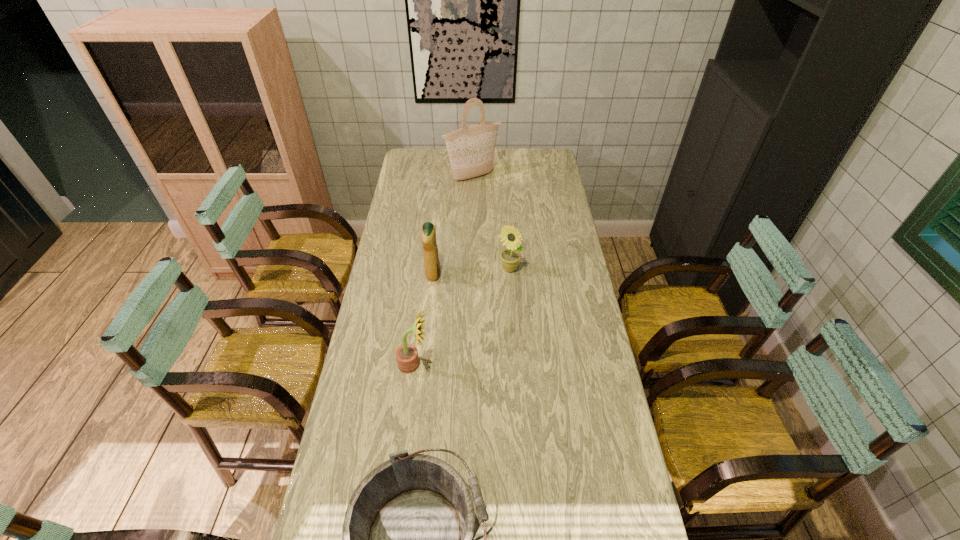
This screenshot has height=540, width=960. What are the coordinates of `object that is the second closest to the farther sunflower` in the screenshot? It's located at [407, 358].

You are a GUI agent. You are given a task and a screenshot of the screen. Output one action in this format:
    pyautogui.click(x=<x>, y=<y>)
    Task: Click on the vacant region that satisfies the following two spatial constraints: 1. on the face of the right sunflower; 2. on the face of the second nearest object
    Image resolution: width=960 pixels, height=540 pixels.
    Given the screenshot: What is the action you would take?
    pyautogui.click(x=516, y=364)

Image resolution: width=960 pixels, height=540 pixels. Find the location of `free region that satisfies the following two spatial constraints: 1. on the face of the right sunflower; 2. on the label of the detergent`. free region that satisfies the following two spatial constraints: 1. on the face of the right sunflower; 2. on the label of the detergent is located at coordinates (510, 274).